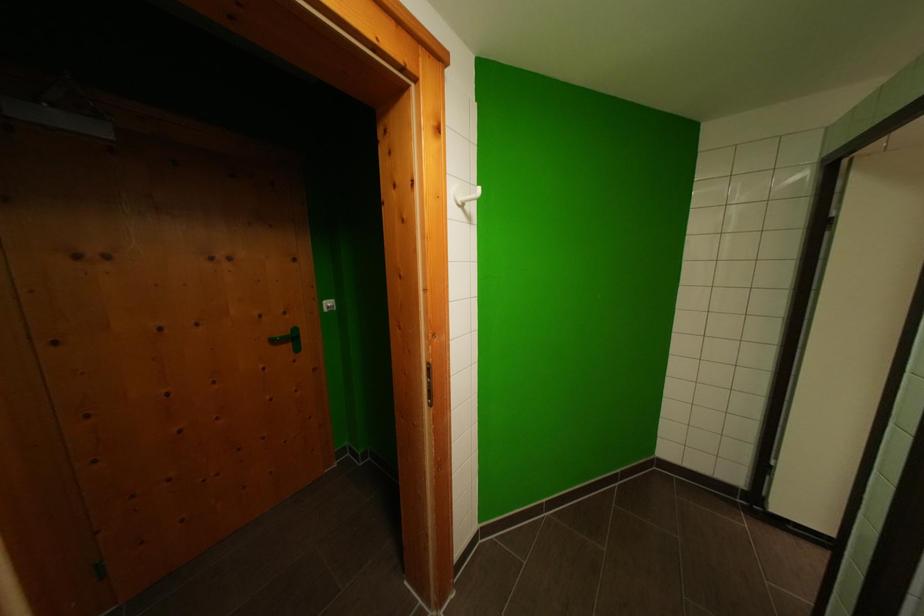
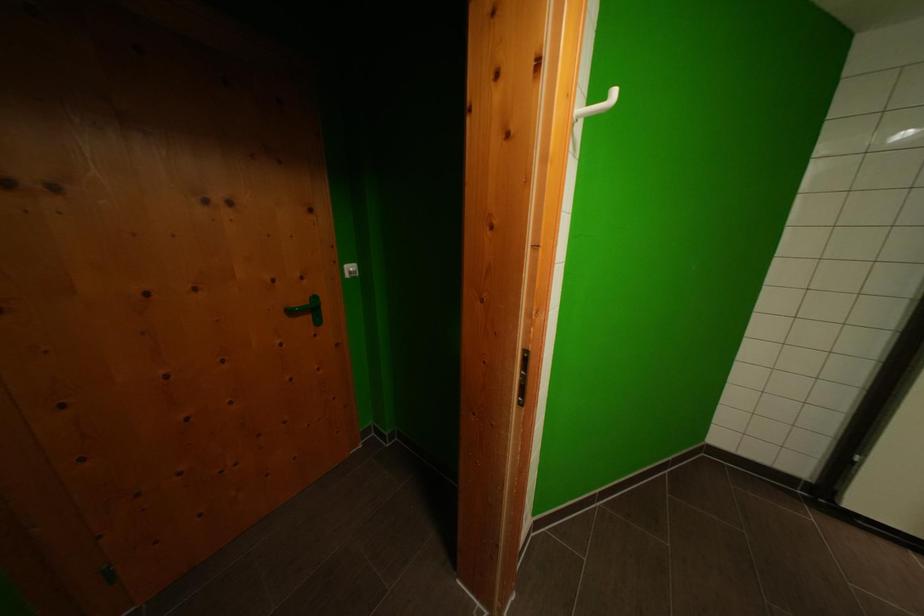
Which direction would the cameraman need to move to produce the second image?

The cameraman walked toward left, forward.